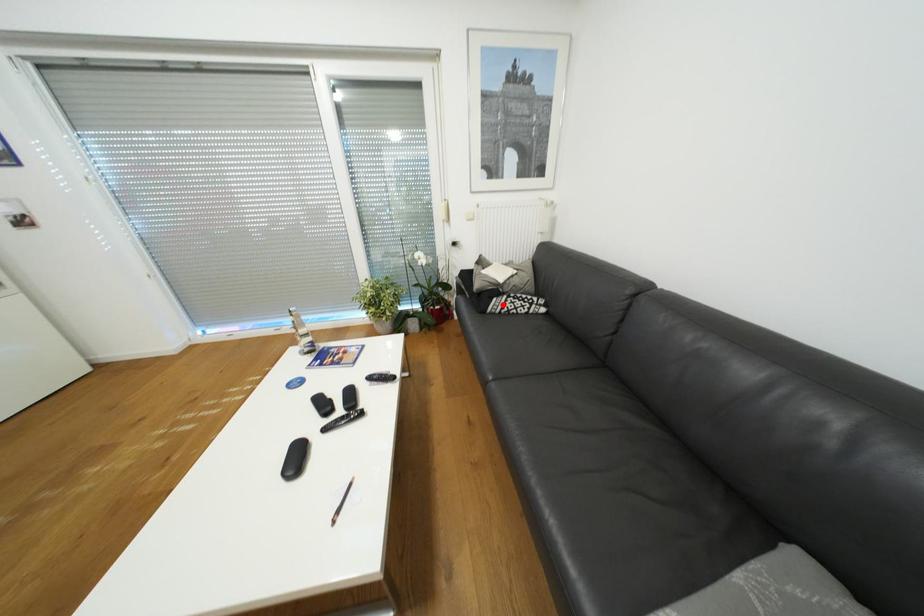
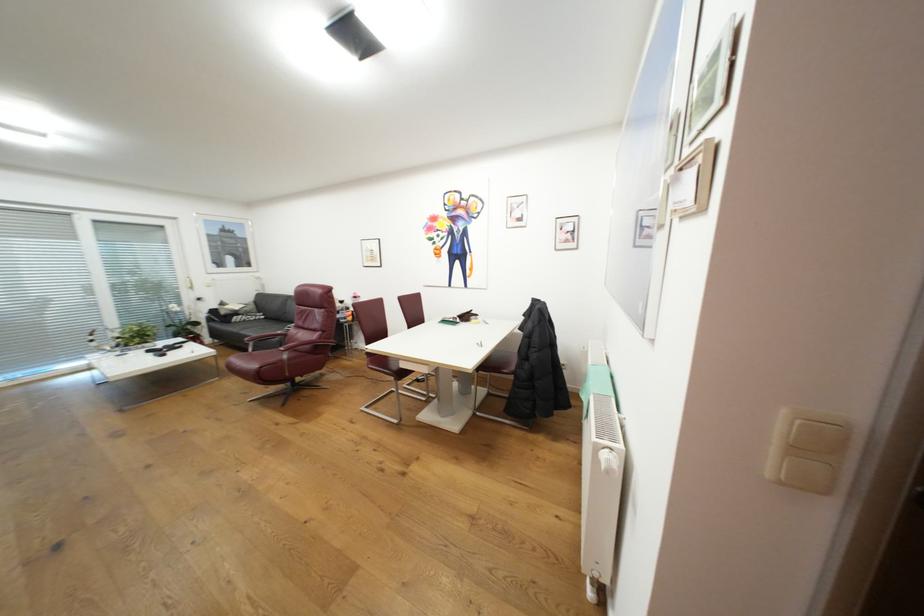
Locate, in the second image, the point that corresponds to the highlighted location in the first image.

(244, 318)